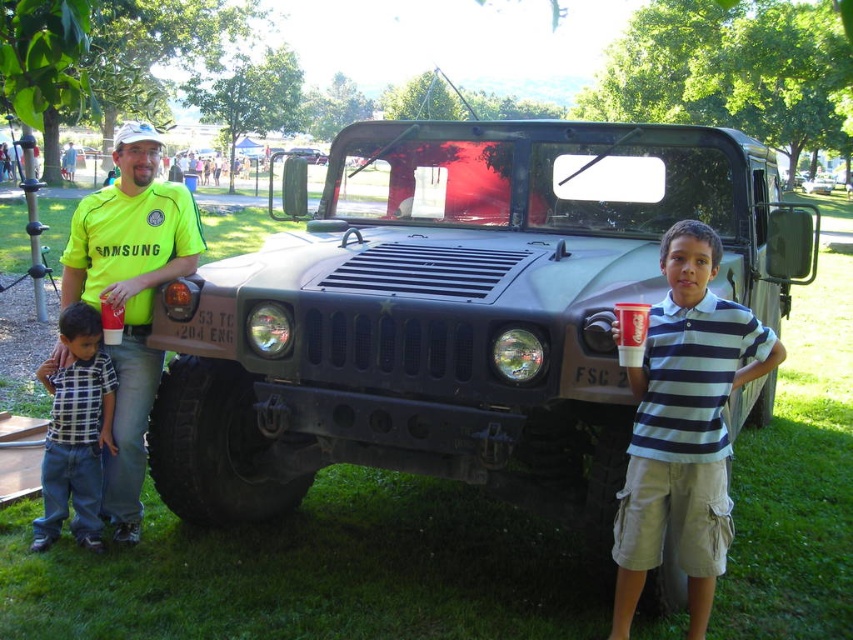
You are an event organizer and need to determine clothing sizes for participants. You see two people wearing the neon green jersey at left and the plaid cotton shirt at left. Which clothing item is smaller in size?

The neon green jersey at left is smaller in size compared to the plaid cotton shirt at left.

In the scene shown: You are a photographer at the event and need to capture a photo where both the neon green jersey at left and the yellow fabric shirt at center are clearly visible. Considering their heights, which one might you need to adjust your camera angle to ensure both are in focus?

The neon green jersey at left is taller than the yellow fabric shirt at center. To ensure both are in focus, you should adjust your camera angle to account for the height difference, possibly tilting the camera slightly downward to include the taller neon green jersey at left while keeping the yellow fabric shirt at center in the frame.